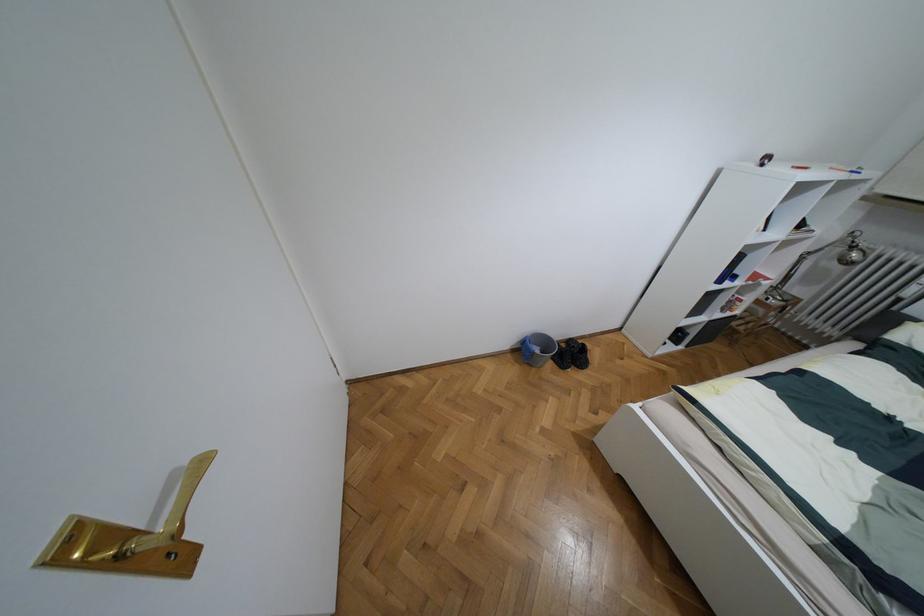
Where would you adjust the desk lamp head? Please return your answer as a coordinate pair (x, y).

(852, 251)